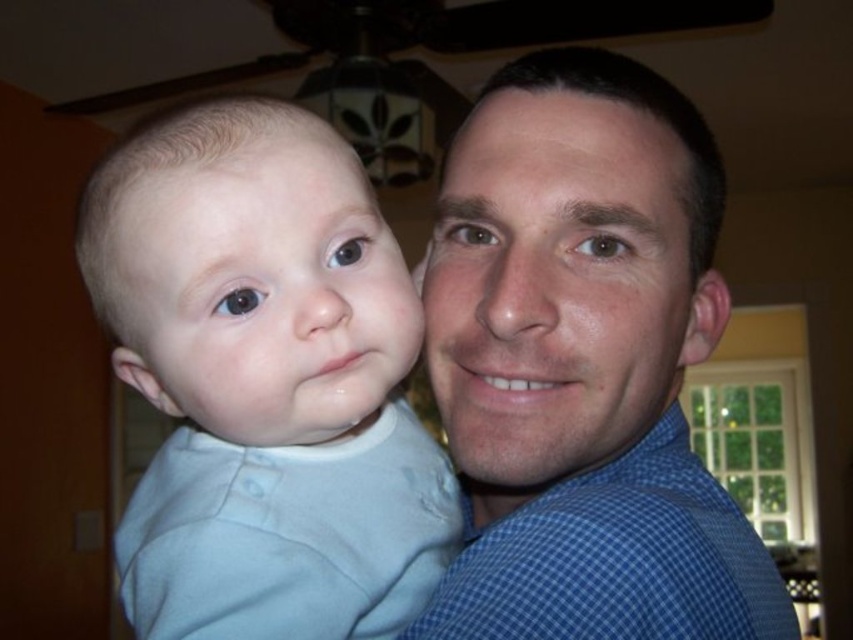
You are trying to determine which of the two points, point (532, 248) or point (688, 445), is nearer to you in the image. Based on the scene, which point is closer?

Point (532, 248) is closer to the viewer than point (688, 445).

You are standing in a room and see two blue checkered shirts in the scene. Which one is closer to you, the blue checkered shirt at center or the blue checkered shirt at right?

The blue checkered shirt at center is closer to you because it is further to the viewer than the blue checkered shirt at right.

You are holding a 40 centimeter long ruler and want to measure the distance from the camera to the point at coordinates point (532, 636). Can you reach that point with your ruler?

The distance of point (532, 636) from camera is 41.63 centimeters, so the ruler is 40 centimeters long which is shorter than the required distance. You cannot reach the point with your ruler.